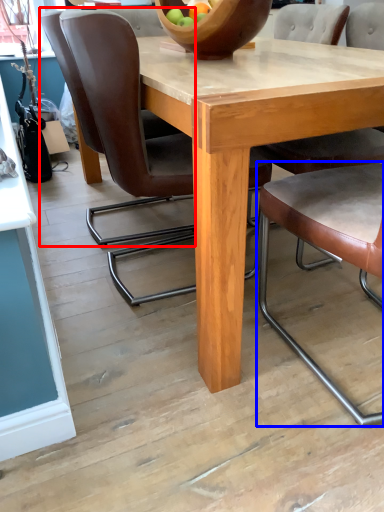
Question: Which point is closer to the camera, chair (highlighted by a red box) or chair (highlighted by a blue box)?

Choices:
 (A) chair
 (B) chair

Answer: (B)